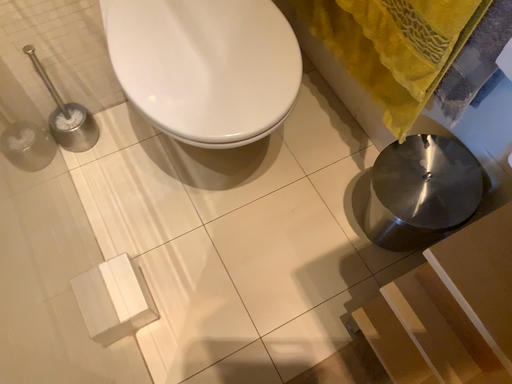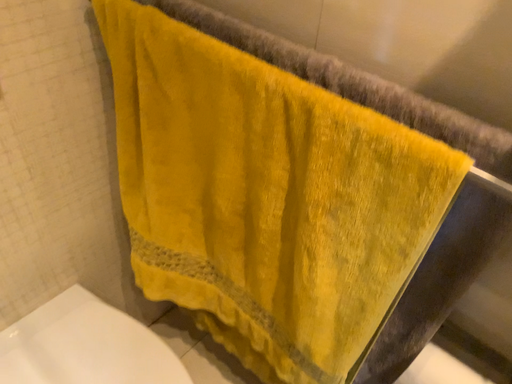
Question: How did the camera likely rotate when shooting the video?

Choices:
 (A) rotated downward
 (B) rotated upward

Answer: (B)